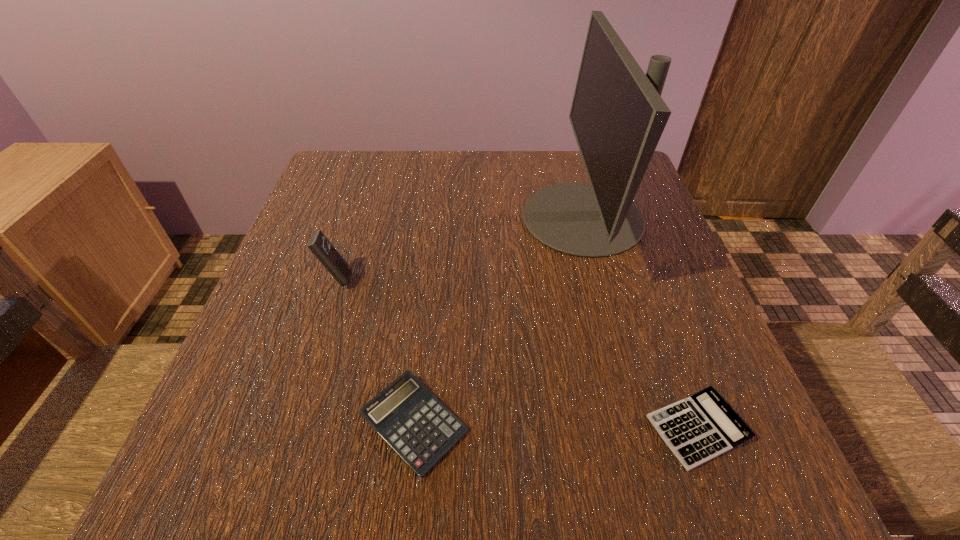
At what (x,y) coordinates should I click in order to perform the action: click on vacant area between the farthest calculator and the second object from left to right. Please return your answer as a coordinate pair (x, y). Image resolution: width=960 pixels, height=540 pixels. Looking at the image, I should click on point(375,351).

Find the location of a particular element. This screenshot has width=960, height=540. free spot between the shortest calculator and the second calculator from left to right is located at coordinates (556, 426).

Locate an element on the screen. empty space that is in between the rightmost calculator and the tallest object is located at coordinates (640, 323).

Where is `free spot between the shortest calculator and the second shortest calculator`? This screenshot has height=540, width=960. free spot between the shortest calculator and the second shortest calculator is located at coordinates (556, 426).

Find the location of a particular element. This screenshot has width=960, height=540. the third closest object relative to the leftmost object is located at coordinates (697, 429).

The width and height of the screenshot is (960, 540). Find the location of `object that ranks as the closest to the second tallest object`. object that ranks as the closest to the second tallest object is located at coordinates (406, 415).

Identify which calculator is the second closest to the shortest object. Please provide its 2D coordinates. Your answer should be formatted as a tuple, i.e. [(x, y)], where the tuple contains the x and y coordinates of a point satisfying the conditions above.

[(319, 245)]

You are a GUI agent. You are given a task and a screenshot of the screen. Output one action in this format:
    pyautogui.click(x=<x>, y=<y>)
    Task: Click on the calculator that is the closest to the second shortest calculator
    
    Given the screenshot: What is the action you would take?
    pyautogui.click(x=319, y=245)

Identify the location of blank space that satisfies the following two spatial constraints: 1. on the front-facing side of the leftmost calculator; 2. on the left side of the third tallest object. (290, 423).

The width and height of the screenshot is (960, 540). Identify the location of free space in the image that satisfies the following two spatial constraints: 1. on the front-facing side of the farthest calculator; 2. on the back side of the shortest calculator. (288, 429).